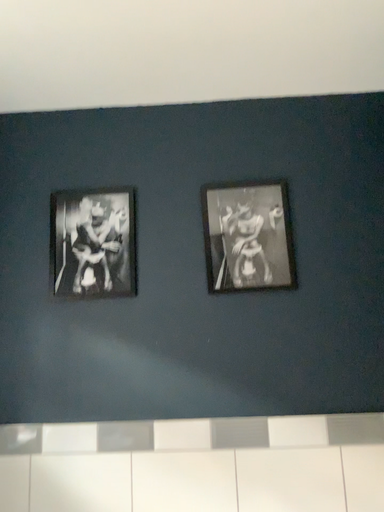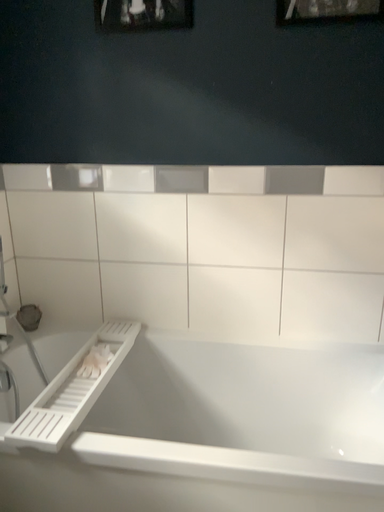
Question: How did the camera likely rotate when shooting the video?

Choices:
 (A) rotated left
 (B) rotated right

Answer: (A)